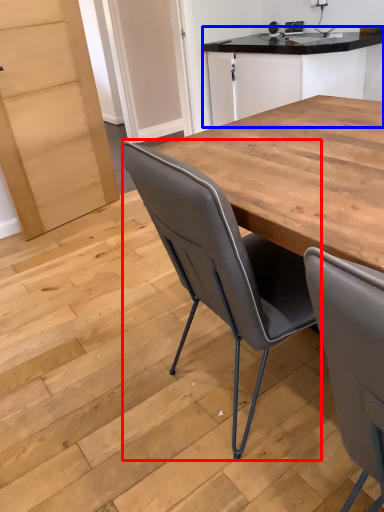
Question: Which object appears closest to the camera in this image, chair (highlighted by a red box) or cabinetry (highlighted by a blue box)?

Choices:
 (A) chair
 (B) cabinetry

Answer: (A)